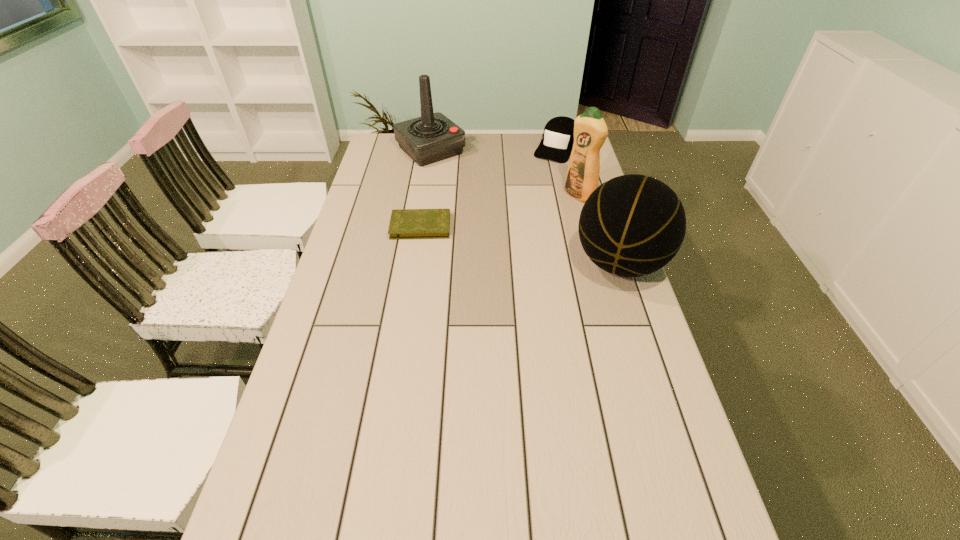
This screenshot has height=540, width=960. What are the coordinates of `free space located on the label of the third nearest object` in the screenshot? It's located at (505, 245).

Find the location of a particular element. vacant space situated 0.140m on the label of the third nearest object is located at coordinates (545, 218).

This screenshot has width=960, height=540. I want to click on vacant space located on the label of the third nearest object, so click(530, 228).

Where is `free space located 0.110m on the front-facing side of the joystick`? The image size is (960, 540). free space located 0.110m on the front-facing side of the joystick is located at coordinates (463, 178).

Locate an element on the screen. free space located 0.260m on the front-facing side of the joystick is located at coordinates (484, 197).

Where is `free space located 0.400m on the front-facing side of the joystick`? Image resolution: width=960 pixels, height=540 pixels. free space located 0.400m on the front-facing side of the joystick is located at coordinates (506, 217).

Find the location of a particular element. Image resolution: width=960 pixels, height=540 pixels. cap present at the far edge is located at coordinates (558, 137).

Identify the location of joystick that is at the far edge. (433, 137).

You are a GUI agent. You are given a task and a screenshot of the screen. Output one action in this format:
    pyautogui.click(x=<x>, y=<y>)
    Task: Click on the diary that is positioned at the left edge
    The image size is (960, 540).
    Given the screenshot: What is the action you would take?
    pyautogui.click(x=405, y=223)

This screenshot has height=540, width=960. Identify the location of joystick that is at the left edge. (433, 137).